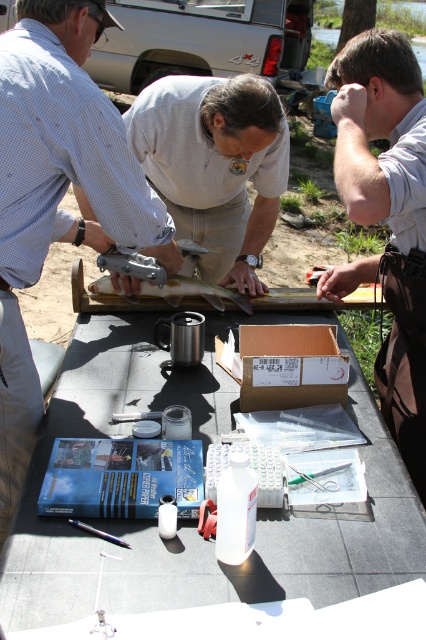
You are a researcher observing the scene. There is a white apron at right and a brown cardboard box at center. Which object is nearer to you?

The white apron at right is closer to the viewer than the brown cardboard box at center.

You are a researcher setting up equipment for a field study. You have a gray rubber table at center and a brown cardboard box at center. Which object should you place first if you need to ensure there is enough space for both items on the work area?

The gray rubber table at center is larger in size than the brown cardboard box at center, so you should place the gray rubber table at center first to ensure there is enough space for both items on the work area.